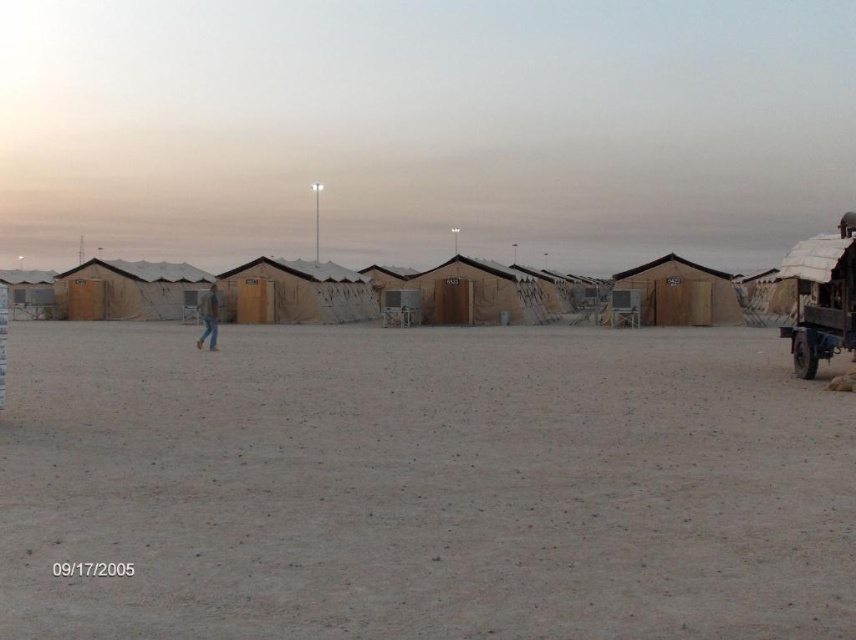
Based on the photo, you are standing at the point marked by the coordinates point [423,486] in the desert scene. What is the color and texture of the ground beneath your feet?

The ground beneath your feet at point [423,486] is dull brown dirt.